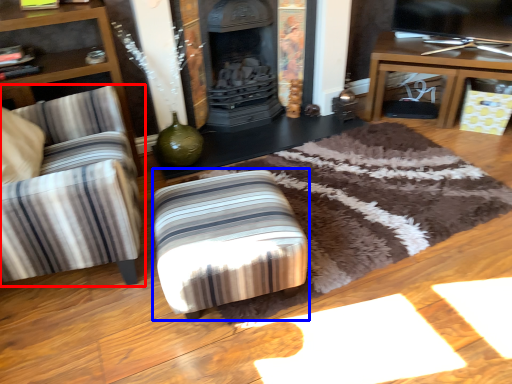
Question: Among these objects, which one is nearest to the camera, chair (highlighted by a red box) or stool (highlighted by a blue box)?

Choices:
 (A) chair
 (B) stool

Answer: (A)